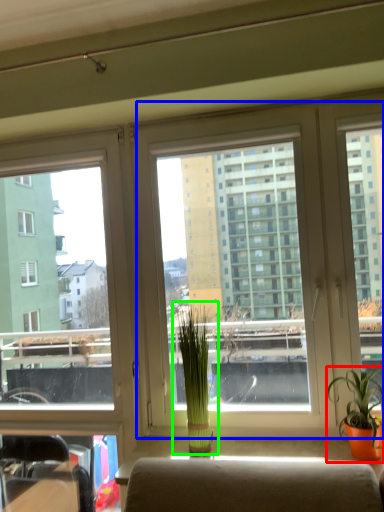
Question: Which is farther away from houseplant (highlighted by a red box)? window screen (highlighted by a blue box) or houseplant (highlighted by a green box)?

Choices:
 (A) window screen
 (B) houseplant

Answer: (B)